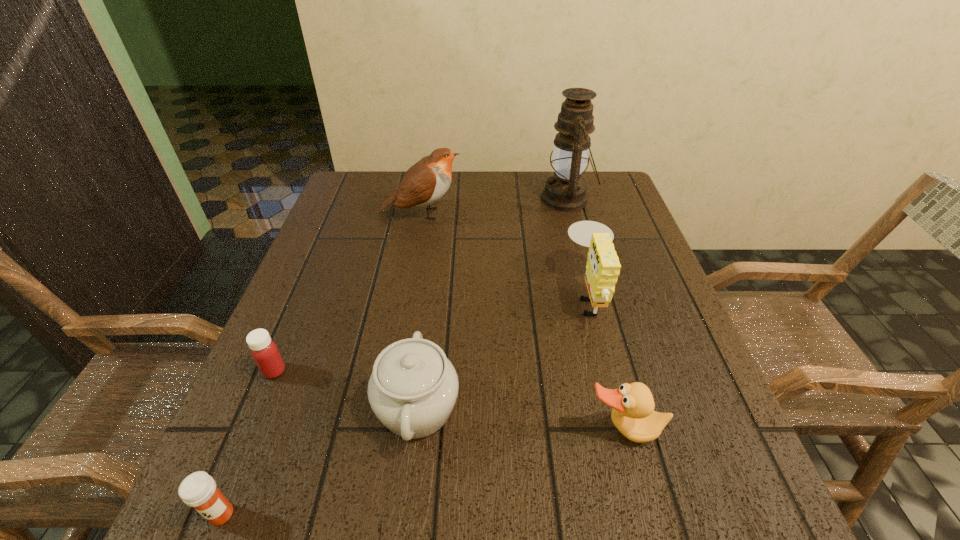
This screenshot has width=960, height=540. Find the location of `free space at the far left corner`. free space at the far left corner is located at coordinates (355, 178).

You are a GUI agent. You are given a task and a screenshot of the screen. Output one action in this format:
    pyautogui.click(x=<x>, y=<y>)
    Task: Click on the vacant area that lies between the farther medicine and the chinaware
    This screenshot has height=540, width=960.
    Given the screenshot: What is the action you would take?
    pyautogui.click(x=346, y=389)

You are a GUI agent. You are given a task and a screenshot of the screen. Output one action in this format:
    pyautogui.click(x=<x>, y=<y>)
    Task: Click on the free spot between the nearer medicine and the chinaware
    
    Given the screenshot: What is the action you would take?
    pyautogui.click(x=319, y=461)

Find the location of a particular element. The width and height of the screenshot is (960, 540). unoccupied area between the duck and the bird is located at coordinates (522, 322).

The height and width of the screenshot is (540, 960). I want to click on free space between the farther medicine and the oil lamp, so coord(420,285).

Find the location of a particular element. The image size is (960, 540). free space between the third tallest object and the bird is located at coordinates (505, 254).

Where is `unoccupied area between the chinaware and the third tallest object`? This screenshot has height=540, width=960. unoccupied area between the chinaware and the third tallest object is located at coordinates (503, 352).

Identify the location of free space between the fifth nearest object and the bird. This screenshot has width=960, height=540. (505, 254).

Identify the location of free spot between the chinaware and the nearest object. (319, 461).

At what (x,y) coordinates should I click in order to perform the action: click on unoccupied position between the chinaware and the tallest object. Please return your answer as a coordinate pair (x, y). This screenshot has height=540, width=960. Looking at the image, I should click on (492, 303).